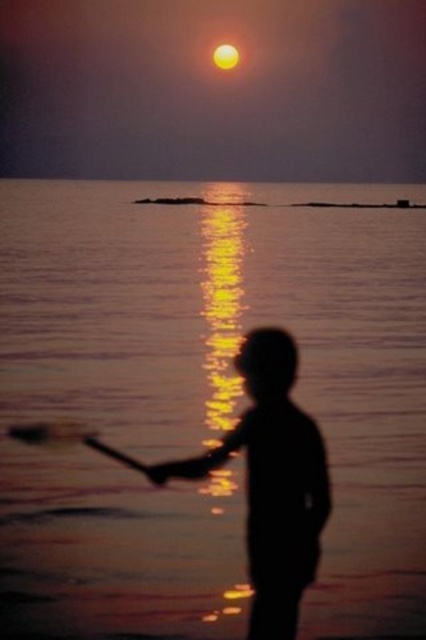
Consider the image. You are a photographer trying to capture the sunset scene. You notice the smooth water at center and the silhouette figure at center. Which object is closer to your camera lens?

The silhouette figure at center is closer to the camera lens because the smooth water at center is further away, as it is positioned behind the figure in the scene.

You are standing at the point closer to you in the scene. Which point are you at, point (x=0, y=275) or point (x=302, y=483)?

You are at point (x=0, y=275) because it is further to the viewer than point (x=302, y=483).